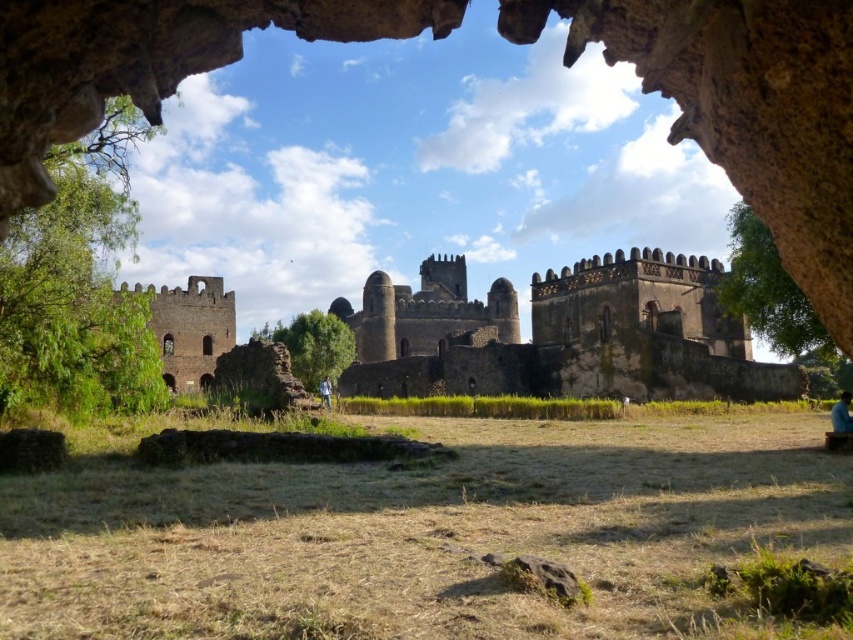
Who is more distant from viewer, (193, 380) or (328, 381)?

Point (193, 380)

How distant is brown stone fort at left from blue denim jeans at lower center?

brown stone fort at left is 36.80 meters from blue denim jeans at lower center.

This screenshot has width=853, height=640. Find the location of `brown stone fort at left`. brown stone fort at left is located at coordinates (189, 328).

Who is lower down, brown stone fort at left or blue fabric person at lower right?

Positioned lower is blue fabric person at lower right.

Is point (196, 376) more distant than point (843, 426)?

Yes.

Between point (218, 280) and point (836, 428), which one is positioned in front?

Point (836, 428) is more forward.

At what (x,y) coordinates should I click in order to perform the action: click on brown stone fort at left. Please return your answer as a coordinate pair (x, y). The width and height of the screenshot is (853, 640). Looking at the image, I should click on (189, 328).

Between point (846, 412) and point (326, 378), which one is positioned in front?

Point (846, 412)

Which is in front, point (846, 428) or point (328, 387)?

Point (846, 428) is more forward.

Identify the location of blue fabric person at lower right. The height and width of the screenshot is (640, 853). (840, 413).